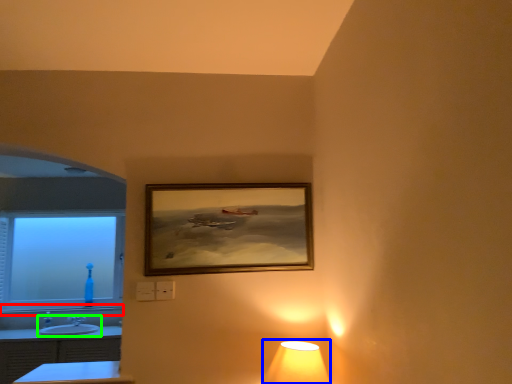
Question: Which is nearer to the window sill (highlighted by a red box)? lamp (highlighted by a blue box) or sink (highlighted by a green box).

Choices:
 (A) lamp
 (B) sink

Answer: (B)